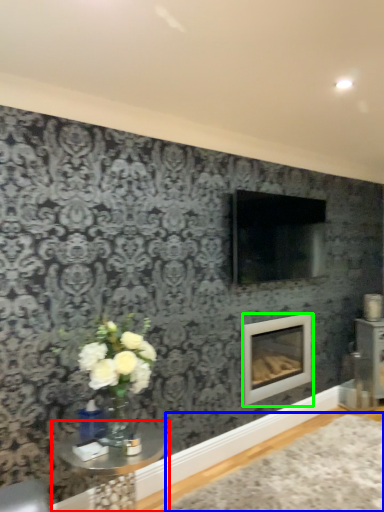
Question: Based on their relative distances, which object is farther from table (highlighted by a red box)? Choose from plain (highlighted by a blue box) and fireplace (highlighted by a green box).

Choices:
 (A) plain
 (B) fireplace

Answer: (B)